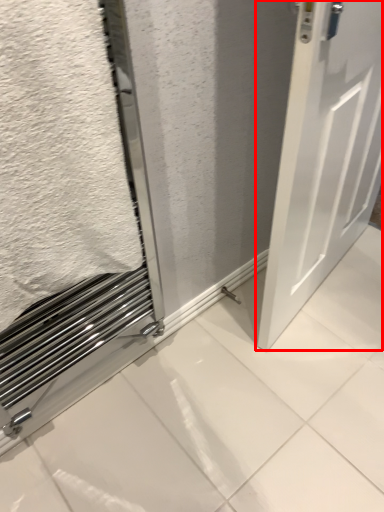
Question: From the image's perspective, what is the correct spatial positioning of door (annotated by the red box) in reference to bath towel?

Choices:
 (A) below
 (B) above

Answer: (A)